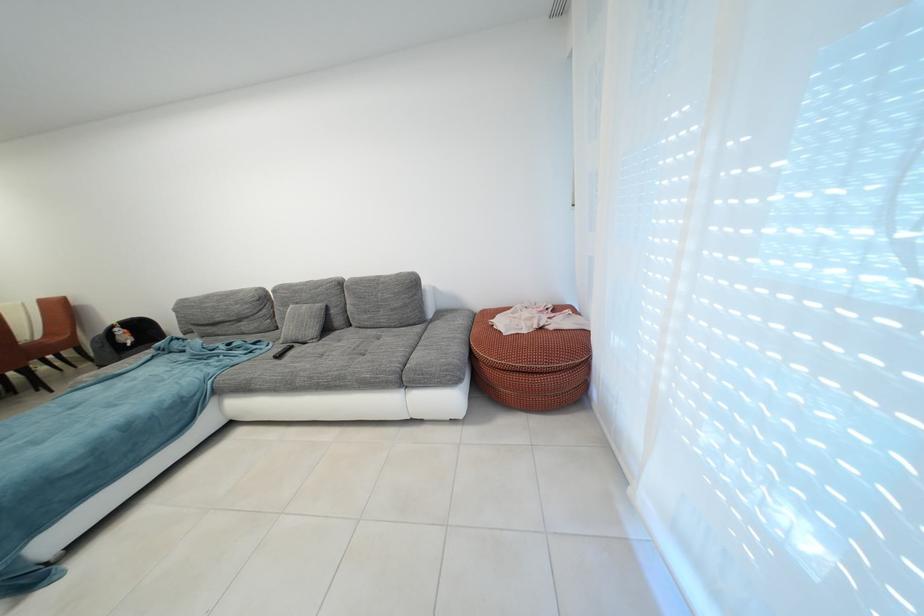
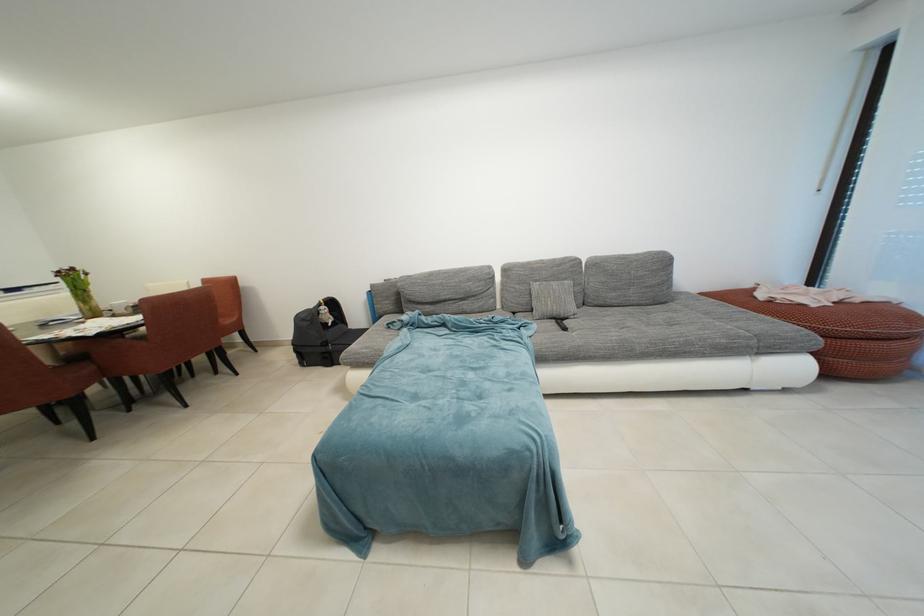
Locate, in the second image, the point that corresponds to pixel 120 331 in the first image.

(329, 309)